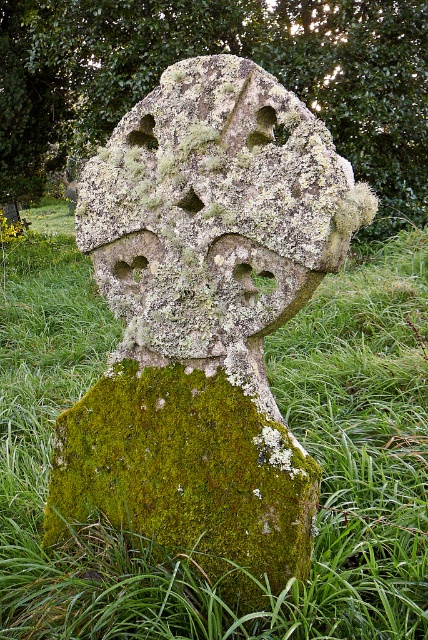
You are standing at the center of a grassy area in a historical site. You see a green mossy stone cross represented by point [205,320]. If you want to walk directly towards the cross, which direction should you head?

The green mossy stone cross at center is represented by point [205,320], so you should head directly towards the center of the area to reach it.

You are standing at the center of the grassy area looking at the ancient stone cross. There are two points marked on the cross. One is at coordinate point (103,490) and the other is at point (104,444). Which point is closer to you?

Point (104,444) is closer to you because it is in front of point (103,490).